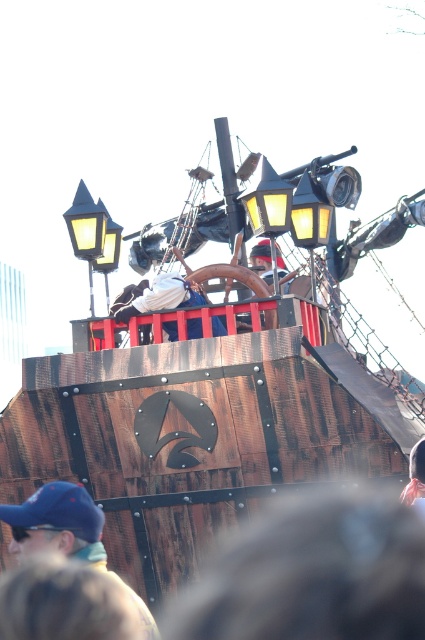
You are standing on the pirate ship deck and want to place a new decorative flag between the blue fabric cap at lower left and the white fabric at center. According to the current setup, where should you place the flag?

The blue fabric cap at lower left is to the left of the white fabric at center, so you should place the flag between them, ensuring it is positioned to the right of the blue fabric cap at lower left and to the left of the white fabric at center.